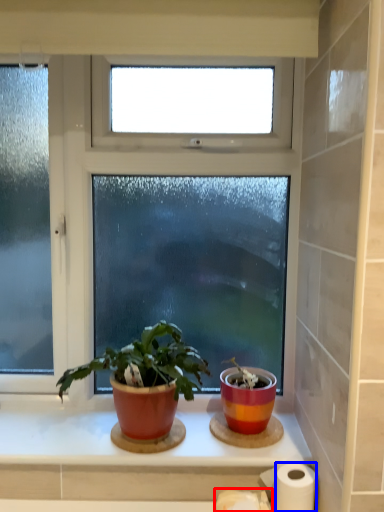
Question: Which point is further to the camera, toilet paper (highlighted by a red box) or paper towel (highlighted by a blue box)?

Choices:
 (A) toilet paper
 (B) paper towel

Answer: (B)